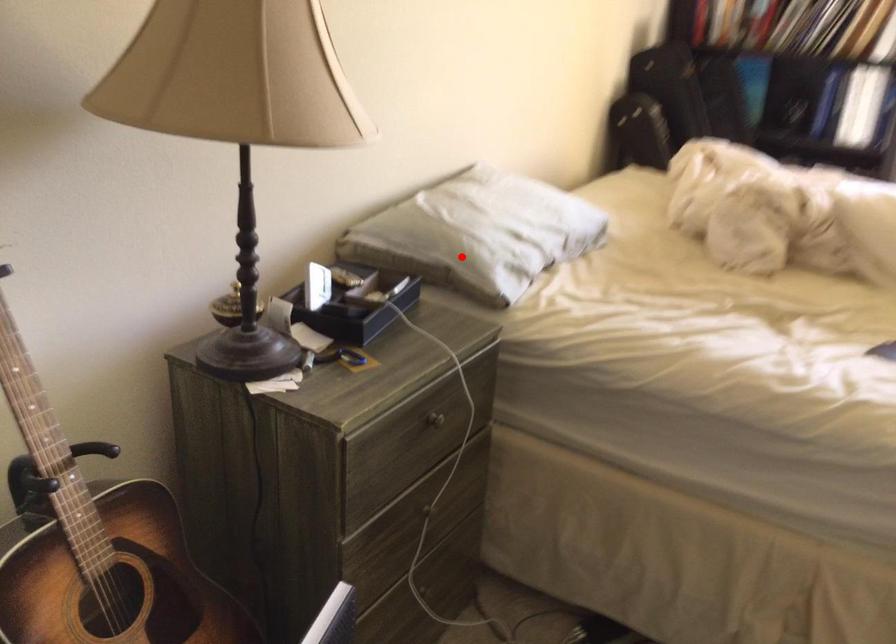
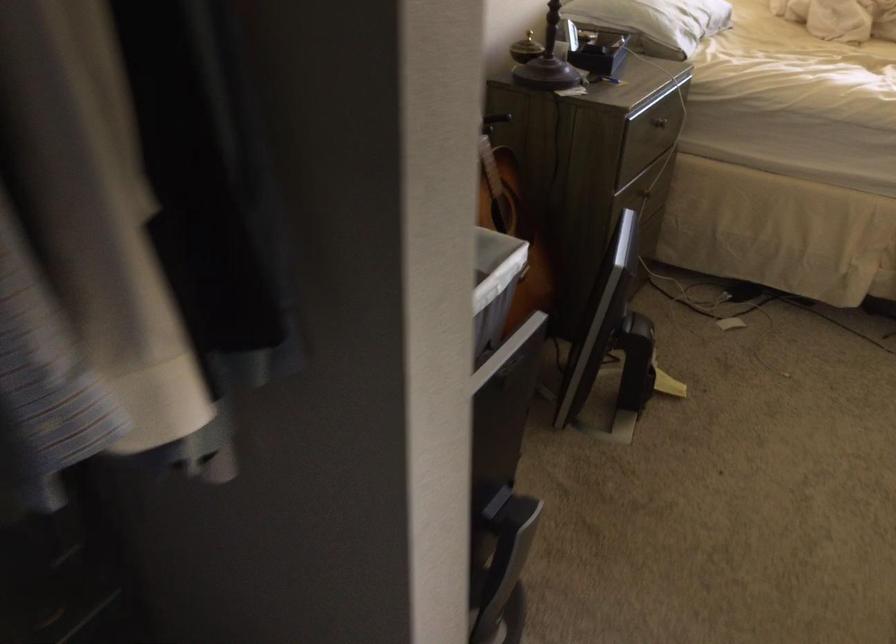
Question: I am providing you with two images of the same scene from different viewpoints. Image1 has a red point marked. In image2, the corresponding 3D location appears at what relative position? Reply with the corresponding letter.

Choices:
 (A) Closer
 (B) Farther

Answer: (B)